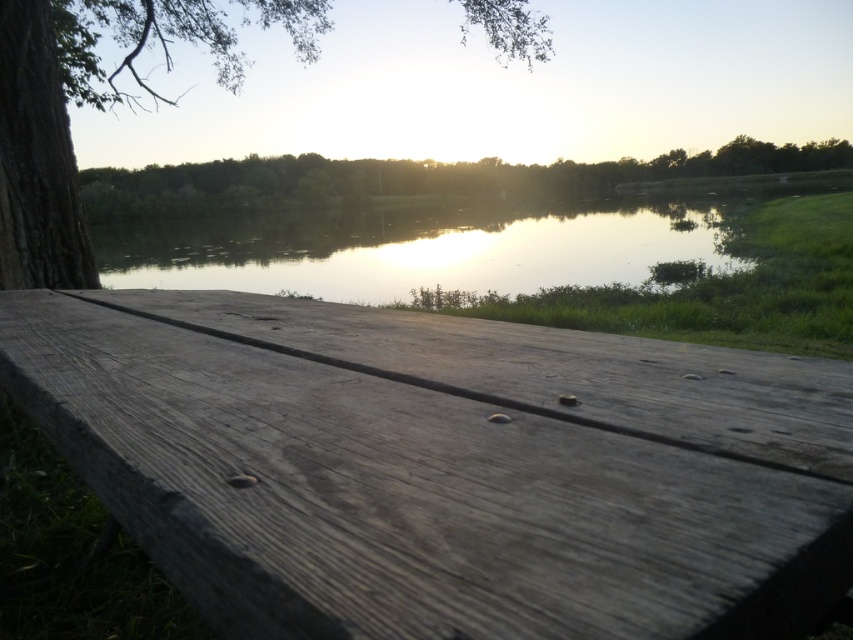
You are standing at the edge of the pond and want to place a small decorative rock on the weathered wood picnic table at center. Given that the coordinates of the picnic table are point (437,483), can you confirm if this point is on the picnic table?

Yes, the point (437,483) is on the weathered wood picnic table at center, so the decorative rock can be placed there.

You are standing at the edge of the scene and want to place a small statue between the glistening water at center and the smooth brown tree trunk at left. Which object should you position the statue closer to if you want it to be more visible from your current viewpoint?

You should position the statue closer to the smooth brown tree trunk at left because it has a greater height than the glistening water at center, making it more visible from your viewpoint.